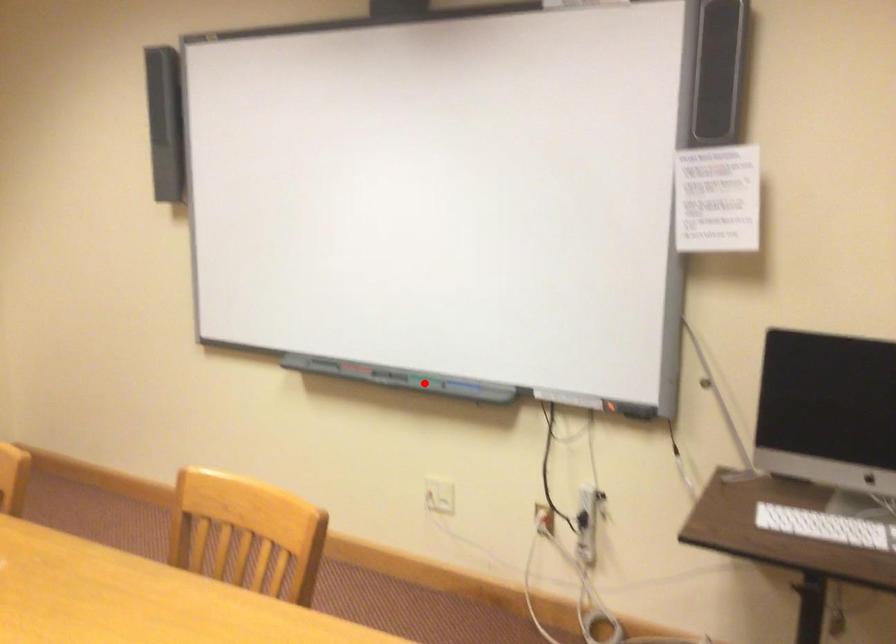
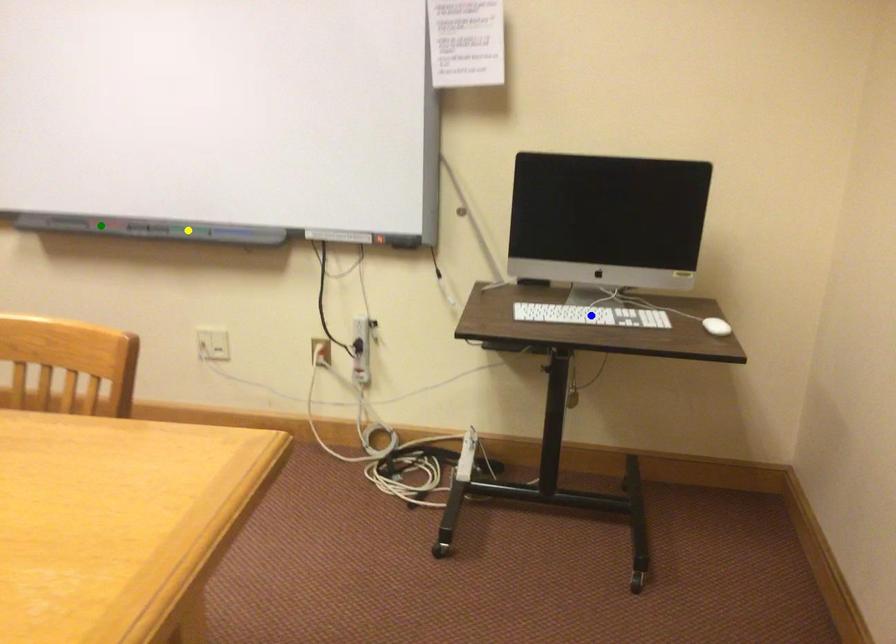
Question: I am providing you with two images of the same scene from different viewpoints. A red point is marked on the first image. You are given multiple points on the second image. Which mark in image 2 goes with the point in image 1?

Choices:
 (A) green point
 (B) yellow point
 (C) blue point

Answer: (B)